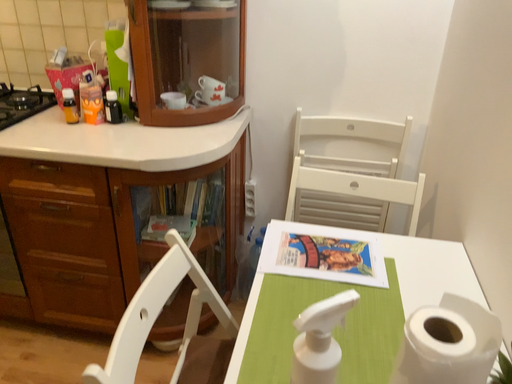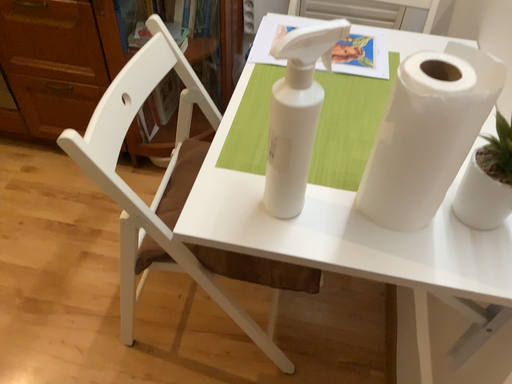
Question: How did the camera likely rotate when shooting the video?

Choices:
 (A) rotated upward
 (B) rotated downward

Answer: (B)